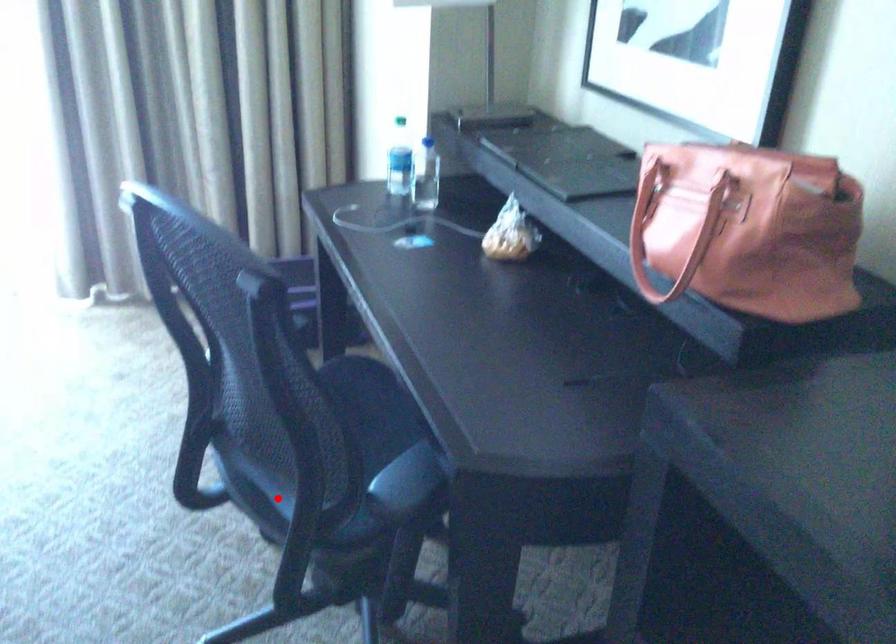
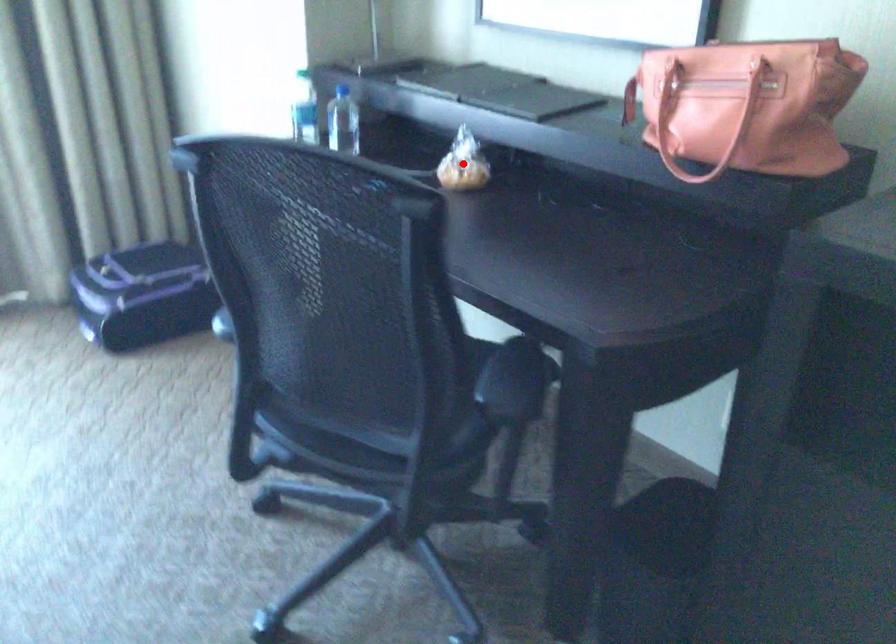
I am providing you with two images of the same scene from different viewpoints. A red point is marked on the first image and another point is marked on the second image. Are the points marked in image1 and image2 representing the same 3D position?

No